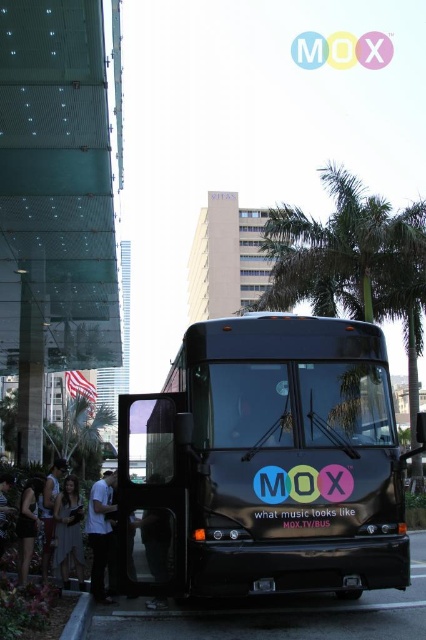
You are a fashion designer observing the scene. You see a white cotton shirt at center and a matte black dress at lower left. Which clothing item is positioned higher in the image?

The white cotton shirt at center is positioned higher than the matte black dress at lower left.

You are a pedestrian standing on the sidewalk and see the gray concrete curb at lower left and the camouflage fabric shirt at lower left. Which object is closer to the ground?

The gray concrete curb at lower left is closer to the ground as it is positioned below the camouflage fabric shirt at lower left.